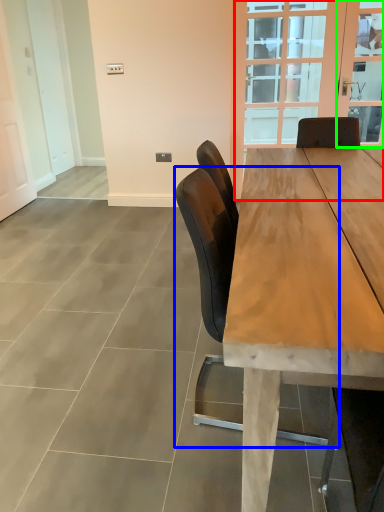
Question: Considering the real-world distances, which object is closest to glass door (highlighted by a red box)? chair (highlighted by a blue box) or window screen (highlighted by a green box).

Choices:
 (A) chair
 (B) window screen

Answer: (B)